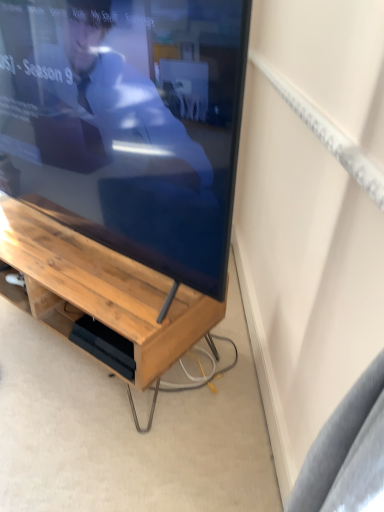
Question: Does matte wood tv at center lie behind wooden desk at center?

Choices:
 (A) yes
 (B) no

Answer: (B)

Question: From the image's perspective, would you say matte wood tv at center is shown under wooden desk at center?

Choices:
 (A) no
 (B) yes

Answer: (A)

Question: Does matte wood tv at center appear on the left side of wooden desk at center?

Choices:
 (A) yes
 (B) no

Answer: (B)

Question: Considering the relative sizes of matte wood tv at center and wooden desk at center in the image provided, is matte wood tv at center shorter than wooden desk at center?

Choices:
 (A) yes
 (B) no

Answer: (B)

Question: Is matte wood tv at center oriented towards wooden desk at center?

Choices:
 (A) yes
 (B) no

Answer: (B)

Question: Does matte wood tv at center appear on the right side of wooden desk at center?

Choices:
 (A) yes
 (B) no

Answer: (A)

Question: Does wooden desk at center have a larger size compared to matte wood tv at center?

Choices:
 (A) no
 (B) yes

Answer: (A)

Question: From a real-world perspective, is wooden desk at center on top of matte wood tv at center?

Choices:
 (A) no
 (B) yes

Answer: (A)

Question: Is wooden desk at center wider than matte wood tv at center?

Choices:
 (A) no
 (B) yes

Answer: (B)

Question: Is matte wood tv at center surrounded by wooden desk at center?

Choices:
 (A) yes
 (B) no

Answer: (B)

Question: Is wooden desk at center positioned far away from matte wood tv at center?

Choices:
 (A) yes
 (B) no

Answer: (B)

Question: Does wooden desk at center lie in front of matte wood tv at center?

Choices:
 (A) no
 (B) yes

Answer: (A)

Question: Considering the positions of point (220, 134) and point (29, 288), is point (220, 134) closer or farther from the camera than point (29, 288)?

Choices:
 (A) closer
 (B) farther

Answer: (A)